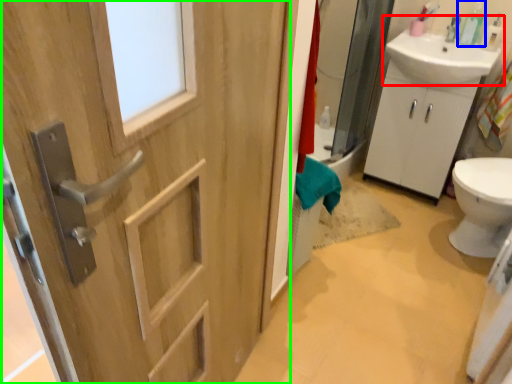
Question: Based on their relative distances, which object is farther from sink (highlighted by a red box)? Choose from soap dispenser (highlighted by a blue box) and door (highlighted by a green box).

Choices:
 (A) soap dispenser
 (B) door

Answer: (B)